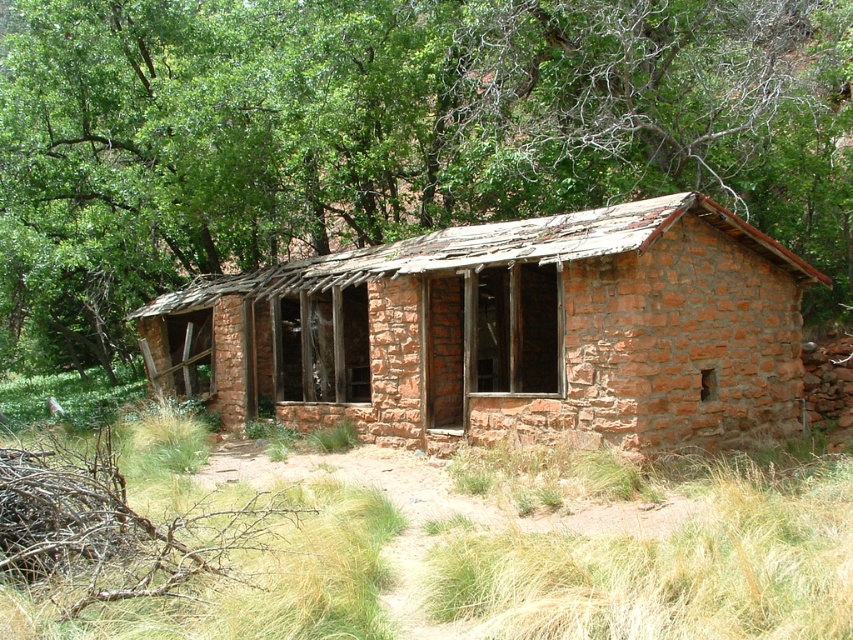
Between point (132, 54) and point (775, 532), which one is positioned in front?

Point (775, 532) is in front.

Identify the location of green leafy tree at upper center. (390, 134).

In the scene shown: Can you confirm if rustic stone hut at center is positioned below dry grass at center?

No.

Can you confirm if rustic stone hut at center is bigger than dry grass at center?

Indeed, rustic stone hut at center has a larger size compared to dry grass at center.

Who is more forward, (440, 328) or (718, 500)?

Positioned in front is point (718, 500).

Locate an element on the screen. This screenshot has width=853, height=640. rustic stone hut at center is located at coordinates (509, 332).

You are a GUI agent. You are given a task and a screenshot of the screen. Output one action in this format:
    pyautogui.click(x=<x>, y=<y>)
    Task: Click on the green leafy tree at upper center
    The height and width of the screenshot is (640, 853).
    Given the screenshot: What is the action you would take?
    pyautogui.click(x=390, y=134)

Describe the element at coordinates (390, 134) in the screenshot. I see `green leafy tree at upper center` at that location.

Locate an element on the screen. This screenshot has height=640, width=853. green leafy tree at upper center is located at coordinates (390, 134).